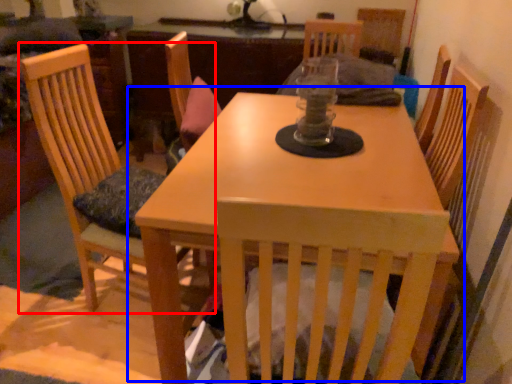
Question: Among these objects, which one is farthest to the camera, chair (highlighted by a red box) or table (highlighted by a blue box)?

Choices:
 (A) chair
 (B) table

Answer: (A)